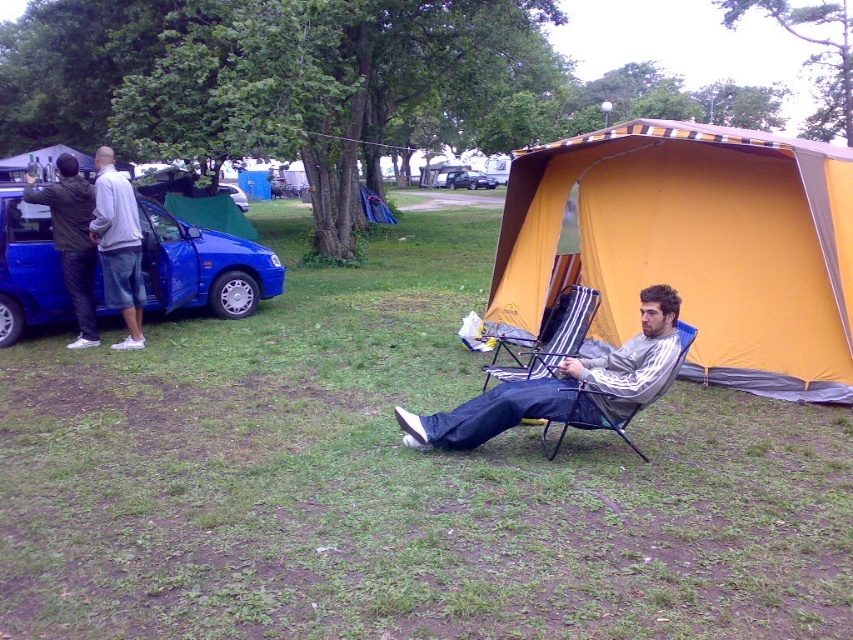
Question: In this image, where is blue matte car at left located relative to blue matte car at center?

Choices:
 (A) above
 (B) below

Answer: (B)

Question: Considering the real-world distances, which object is farthest from the gray fabric folding chair at center?

Choices:
 (A) white cotton shorts at left
 (B) dark green jacket at left
 (C) striped fabric folding chair at center

Answer: (B)

Question: Which object is farther from the camera taking this photo?

Choices:
 (A) blue matte car at center
 (B) blue matte car at left
 (C) white cotton shorts at left

Answer: (A)

Question: Which point is closer to the camera taking this photo?

Choices:
 (A) 457,186
 (B) 606,424
 (C) 466,406
 (D) 64,316

Answer: (B)

Question: Does blue matte car at left have a lesser width compared to dark green jacket at left?

Choices:
 (A) yes
 (B) no

Answer: (B)

Question: Can you confirm if gray striped shirt at center is positioned above metallic silver van at center?

Choices:
 (A) yes
 (B) no

Answer: (B)